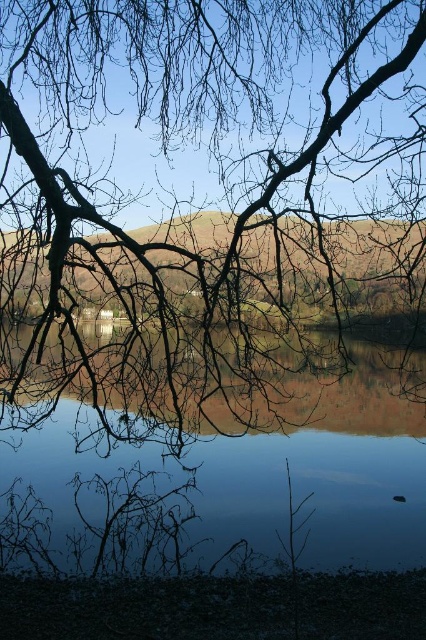
Question: Does brown/rough branches at upper center come in front of transparent glass water at center?

Choices:
 (A) yes
 (B) no

Answer: (A)

Question: Can you confirm if brown/rough branches at upper center is positioned to the right of transparent glass water at center?

Choices:
 (A) yes
 (B) no

Answer: (B)

Question: Observing the image, what is the correct spatial positioning of brown/rough branches at upper center in reference to transparent glass water at center?

Choices:
 (A) right
 (B) left

Answer: (B)

Question: Which point is closer to the camera?

Choices:
 (A) transparent glass water at center
 (B) brown/rough branches at upper center

Answer: (B)

Question: Which object appears farthest from the camera in this image?

Choices:
 (A) brown/rough branches at upper center
 (B) transparent glass water at center

Answer: (B)

Question: Which point appears farthest from the camera in this image?

Choices:
 (A) pos(20,316)
 (B) pos(189,493)

Answer: (B)